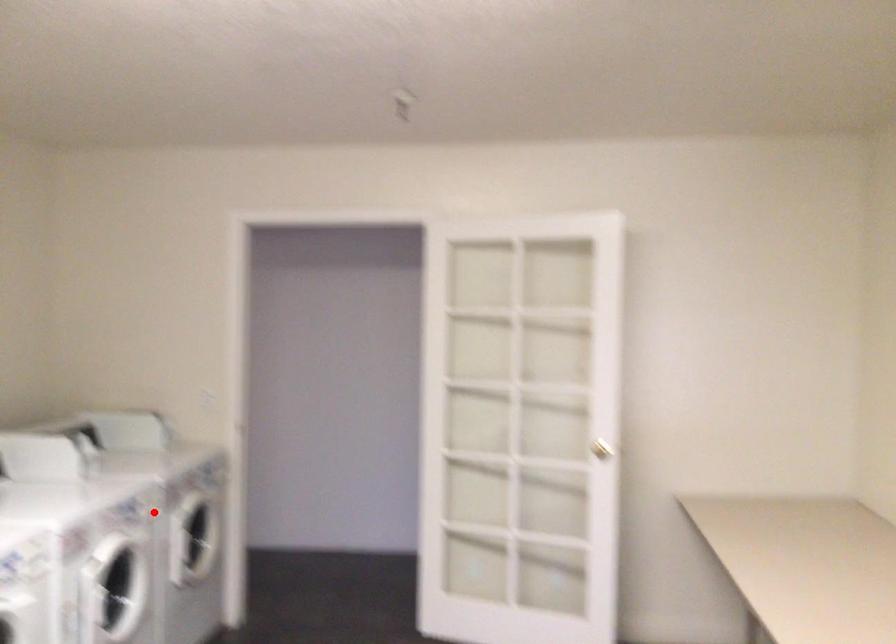
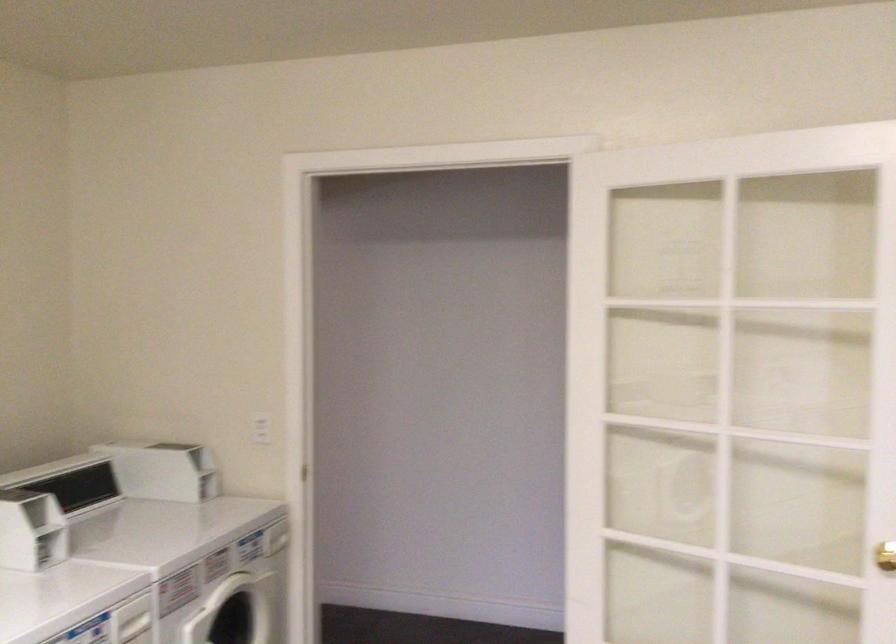
Where in the second image is the point corresponding to the highlighted location from the first image?

(133, 621)